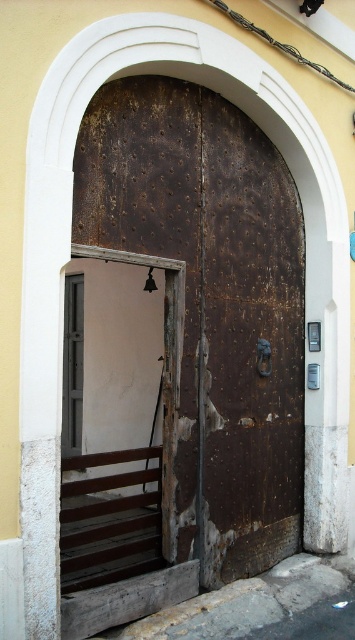
What are the coordinates of the rusty metal door at center?

The coordinates of the rusty metal door at center are 0.473 in the x direction and 0.597 in the y direction.

You are a delivery person trying to find the correct apartment entrance. You see a rusty metal door at center and a metallic gray door at left. According to the building layout, the apartment you need is on the left side of the building. Which door should you choose?

You should choose the metallic gray door at left because the rusty metal door at center is positioned on the right side of it, meaning the metallic gray door at left is on the left side of the building.

You are a delivery person carrying a large package that requires a 3.5 meter wide space to maneuver. You see the rusty metal door at center and the metallic gray door at left. Is there enough space between them to move your package through?

The rusty metal door at center and the metallic gray door at left are 3.04 meters apart from each other, so there is not enough space to maneuver a package requiring 3.5 meters of clearance.